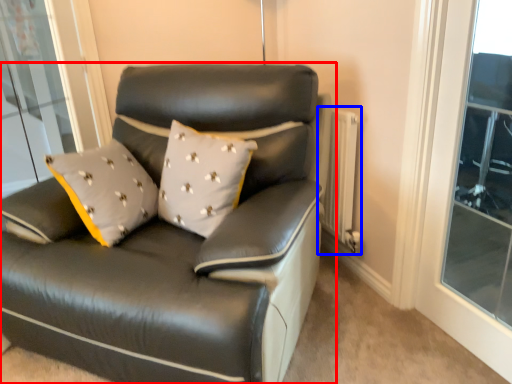
Question: Among these objects, which one is farthest to the camera, studio couch (highlighted by a red box) or radiator (highlighted by a blue box)?

Choices:
 (A) studio couch
 (B) radiator

Answer: (B)